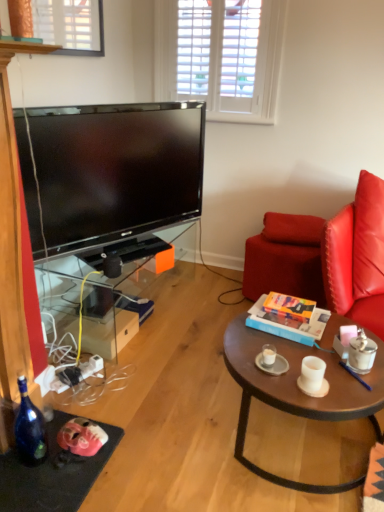
This screenshot has width=384, height=512. Identify the location of vacant area on the back side of white matte coffee cup at center right, placed as the 2th coffee cup when sorted from right to left. (301, 349).